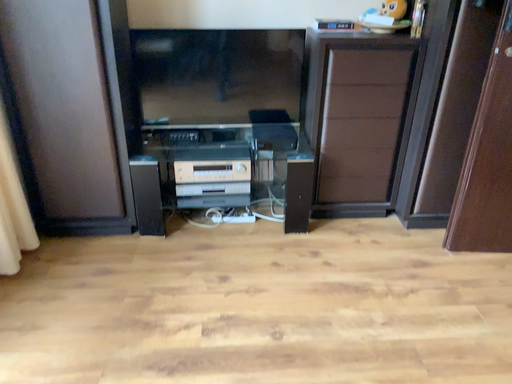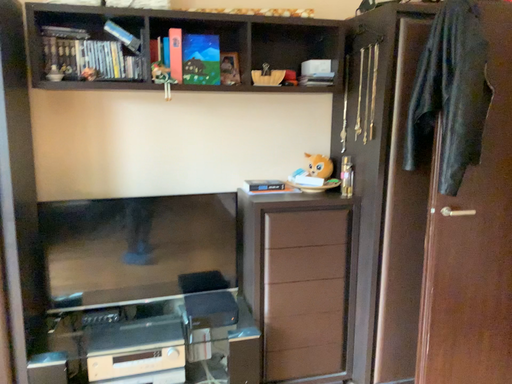
Question: Which way did the camera rotate in the video?

Choices:
 (A) rotated downward
 (B) rotated upward

Answer: (B)